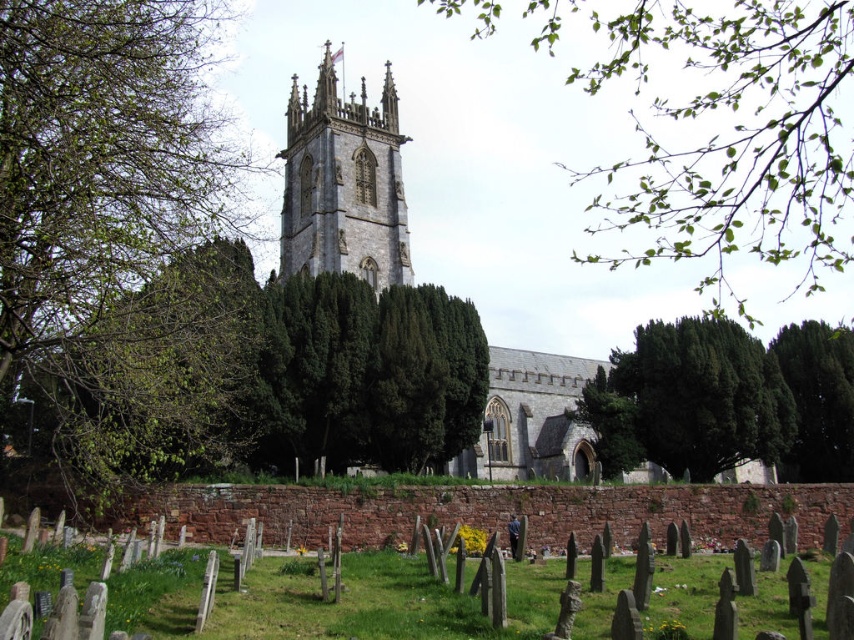
Can you confirm if green leafy branch at upper center is shorter than green leafy tree at left?

In fact, green leafy branch at upper center may be taller than green leafy tree at left.

The image size is (854, 640). What are the coordinates of `green leafy branch at upper center` in the screenshot? It's located at (724, 132).

Who is more distant from viewer, (x=390, y=188) or (x=300, y=196)?

Point (x=300, y=196)

Which is more to the right, stone church at center or stone gothic tower at center?

Positioned to the right is stone church at center.

At what (x,y) coordinates should I click in order to perform the action: click on stone church at center. Please return your answer as a coordinate pair (x, y). Looking at the image, I should click on (344, 184).

At what (x,y) coordinates should I click in order to perform the action: click on green coniferous tree at center. Please return your answer as a coordinate pair (x, y). This screenshot has height=640, width=854. Looking at the image, I should click on (266, 372).

Between point (217, 396) and point (708, 161), which one is positioned in front?

Point (217, 396)

Where is `green coniferous tree at center`? This screenshot has width=854, height=640. green coniferous tree at center is located at coordinates (266, 372).